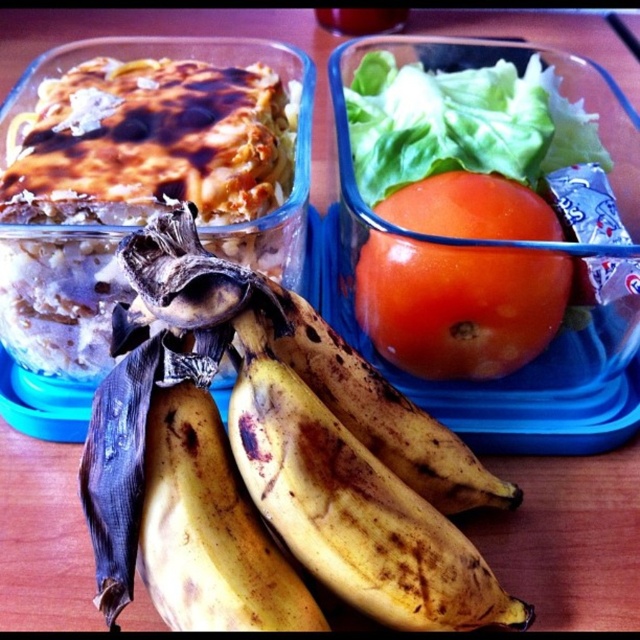
Can you confirm if ripe yellow banana at lower left is positioned to the left of red matte tomato at center?

Indeed, ripe yellow banana at lower left is positioned on the left side of red matte tomato at center.

Can you confirm if ripe yellow banana at lower left is positioned above red matte tomato at center?

Actually, ripe yellow banana at lower left is below red matte tomato at center.

Does point (156, 608) come farther from viewer compared to point (525, 323)?

No, it is not.

Find the location of a particular element. This screenshot has width=640, height=640. ripe yellow banana at lower left is located at coordinates (272, 461).

Who is more distant from viewer, (401, 580) or (480, 212)?

The point (480, 212) is behind.

Does ripe yellow banana at lower left have a smaller size compared to green leafy lettuce at upper center?

Yes.

I want to click on ripe yellow banana at lower left, so click(x=272, y=461).

Based on the photo, does green leafy lettuce at upper center have a smaller size compared to red matte tomato at center?

Incorrect, green leafy lettuce at upper center is not smaller in size than red matte tomato at center.

Who is lower down, green leafy lettuce at upper center or red matte tomato at center?

red matte tomato at center is lower down.

The height and width of the screenshot is (640, 640). In order to click on green leafy lettuce at upper center in this screenshot , I will do `click(480, 198)`.